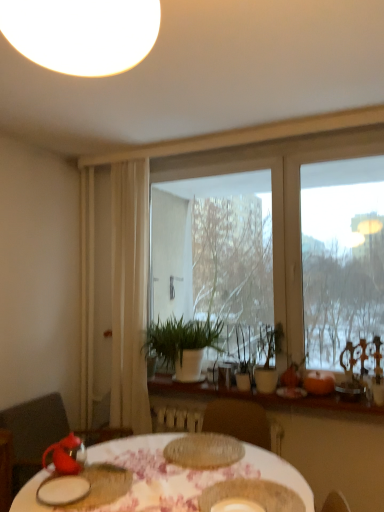
Identify the location of vacant space in between matte ceramic bowl at center, which is the 7th tableware from left to right, and translucent glass plate at center, which is the fourth tableware from left to right. This screenshot has width=384, height=512. (224, 476).